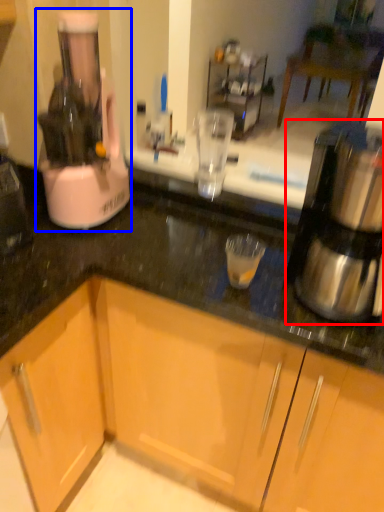
Question: Which object appears farthest to the camera in this image, kitchen appliance (highlighted by a red box) or home appliance (highlighted by a blue box)?

Choices:
 (A) kitchen appliance
 (B) home appliance

Answer: (B)